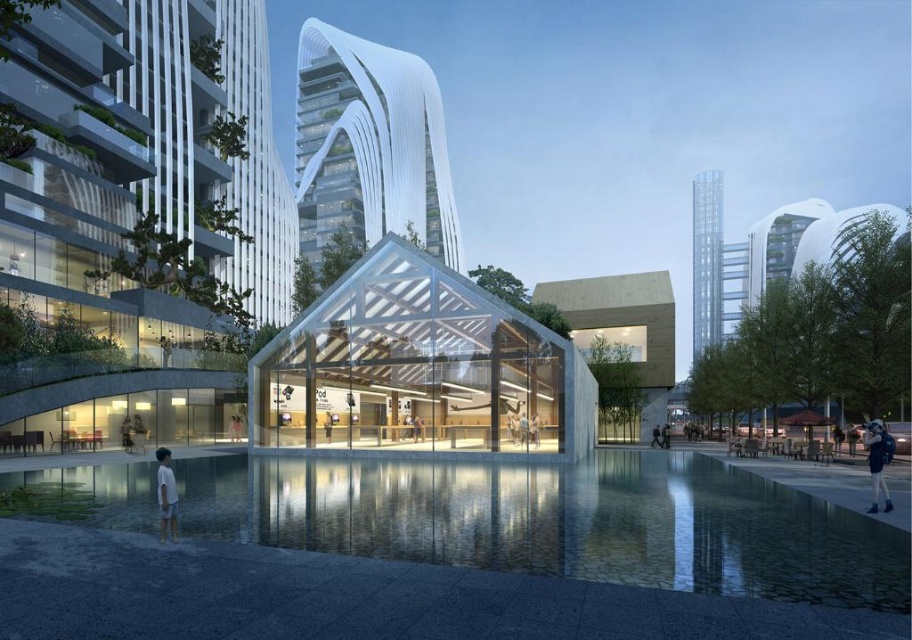
Who is positioned more to the left, clear glass pool at lower center or denim jacket at lower right?

From the viewer's perspective, clear glass pool at lower center appears more on the left side.

Is clear glass pool at lower center bigger than denim jacket at lower right?

Yes, clear glass pool at lower center is bigger than denim jacket at lower right.

Does point (472, 467) come behind point (889, 451)?

That is True.

The image size is (912, 640). Identify the location of clear glass pool at lower center. (560, 522).

What do you see at coordinates (166, 493) in the screenshot? I see `white cotton shorts at lower left` at bounding box center [166, 493].

Can you confirm if white cotton shorts at lower left is thinner than yellow fabric bag at center?

Incorrect, white cotton shorts at lower left's width is not less than yellow fabric bag at center's.

Locate an element on the screen. white cotton shorts at lower left is located at coordinates pos(166,493).

Is transparent glass tower at right positioned at the back of white cotton shorts at lower left?

Yes, transparent glass tower at right is further from the viewer.

Does point (701, 182) lie in front of point (161, 460)?

No, it is behind (161, 460).

Find the location of a particular element. The width and height of the screenshot is (912, 640). transparent glass tower at right is located at coordinates (706, 260).